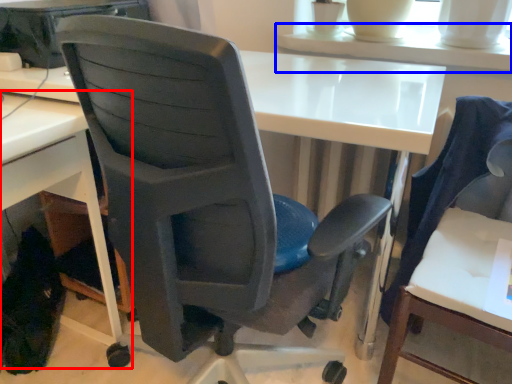
Question: Which object appears closest to the camera in this image, desk (highlighted by a red box) or table (highlighted by a blue box)?

Choices:
 (A) desk
 (B) table

Answer: (A)